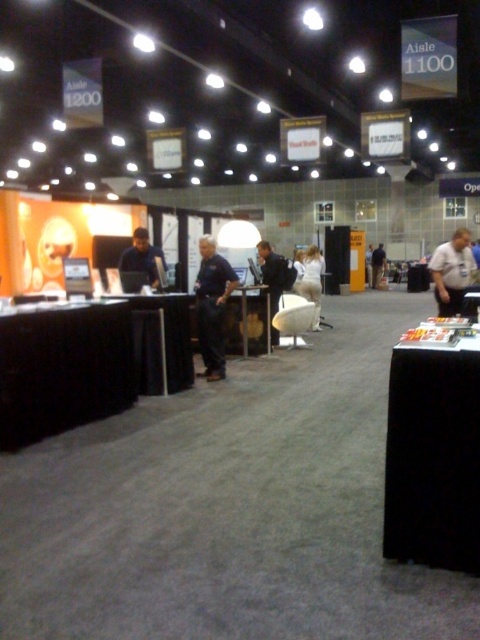
Can you confirm if black fabric table at lower right is positioned to the right of dark blue jeans at center?

No, black fabric table at lower right is not to the right of dark blue jeans at center.

Is black fabric table at lower right smaller than dark blue jeans at center?

Yes.

Does point (427, 454) lie in front of point (372, 288)?

Yes.

The height and width of the screenshot is (640, 480). What are the coordinates of `black fabric table at lower right` in the screenshot? It's located at (433, 451).

Is black plastic table at center closer to the viewer compared to dark blue jeans at center?

That is True.

Is black plastic table at center positioned behind dark blue jeans at center?

No, it is not.

Which is behind, point (245, 300) or point (382, 250)?

The point (382, 250) is behind.

Image resolution: width=480 pixels, height=640 pixels. I want to click on black plastic table at center, so 248,321.

Is black fabric table at lower right to the right of matte black shirt at center from the viewer's perspective?

Correct, you'll find black fabric table at lower right to the right of matte black shirt at center.

Is black fabric table at lower right bigger than matte black shirt at center?

Yes, black fabric table at lower right is bigger than matte black shirt at center.

Which is in front, point (407, 468) or point (144, 273)?

Point (407, 468) is more forward.

In order to click on black fabric table at lower right in this screenshot , I will do `click(433, 451)`.